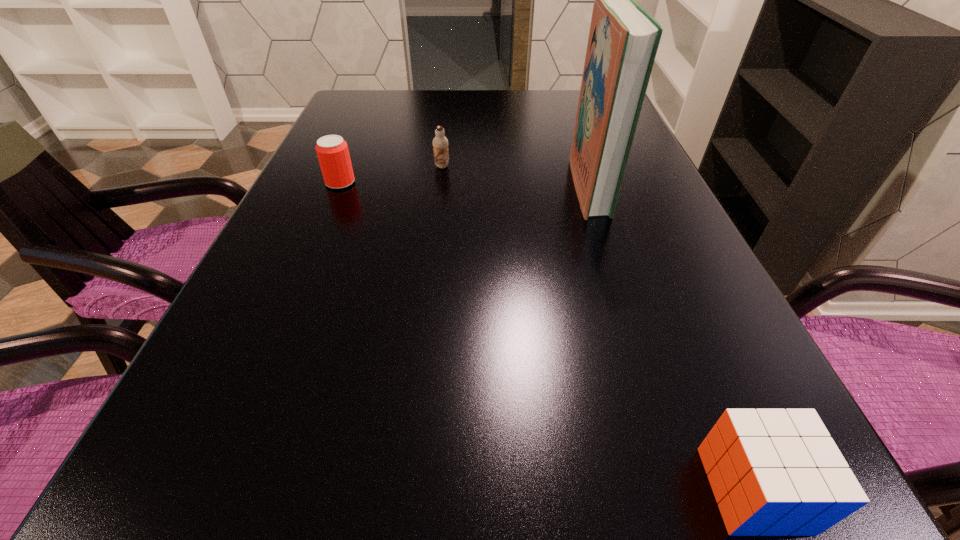
Locate an element on the screen. The height and width of the screenshot is (540, 960). the tallest object is located at coordinates (623, 41).

Locate an element on the screen. The image size is (960, 540). beer can is located at coordinates (332, 151).

Locate an element on the screen. The width and height of the screenshot is (960, 540). the second object from left to right is located at coordinates (440, 143).

Identify the location of cube. The image size is (960, 540). (774, 472).

Locate an element on the screen. vacant space located 0.350m on the cover of the hardback book is located at coordinates (420, 186).

Identify the location of free space located on the cover of the hardback book. (539, 186).

Where is `vacant area situated on the cover of the hardback book`? This screenshot has height=540, width=960. vacant area situated on the cover of the hardback book is located at coordinates (525, 186).

What are the coordinates of `free space located 0.220m on the back of the beer can` in the screenshot? It's located at (362, 132).

Where is `vacant space located 0.060m on the left of the third object from right to left`? This screenshot has width=960, height=540. vacant space located 0.060m on the left of the third object from right to left is located at coordinates (409, 166).

Locate an element on the screen. This screenshot has height=540, width=960. free space located 0.100m on the back of the cube is located at coordinates (707, 381).